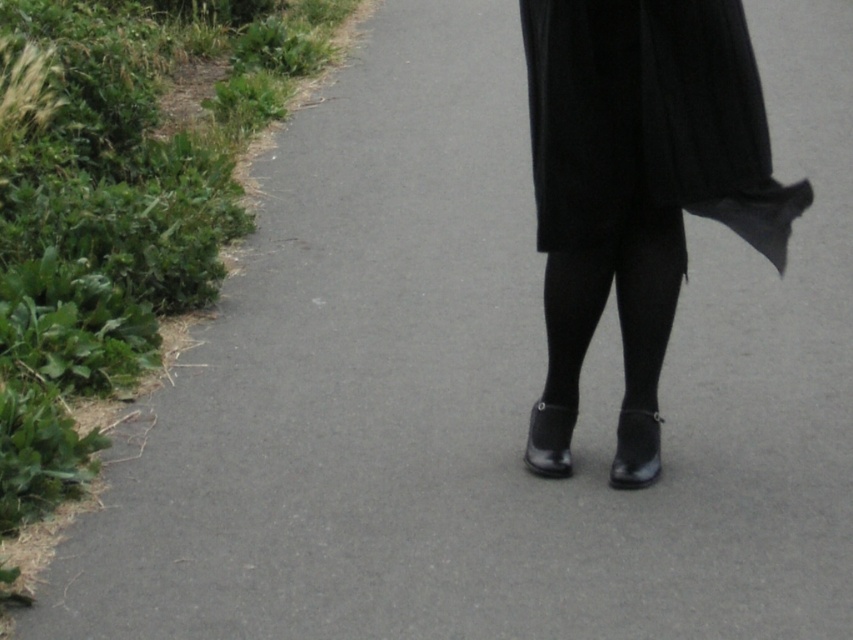
Who is taller, black matte skirt at center or black tights at center?

Standing taller between the two is black matte skirt at center.

Is black matte skirt at center further to camera compared to black tights at center?

No, it is in front of black tights at center.

Between point (651, 72) and point (573, 257), which one is positioned behind?

The point (573, 257) is behind.

Locate an element on the screen. The image size is (853, 640). black matte skirt at center is located at coordinates (648, 120).